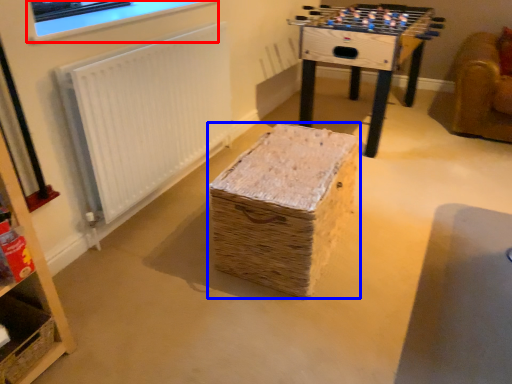
Question: Which of the following is the farthest to the observer, computer monitor (highlighted by a red box) or furniture (highlighted by a blue box)?

Choices:
 (A) computer monitor
 (B) furniture

Answer: (A)